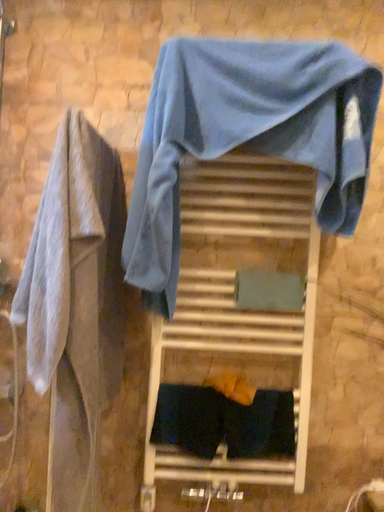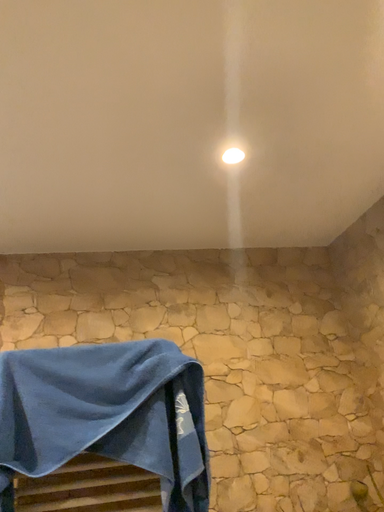
Question: How did the camera likely rotate when shooting the video?

Choices:
 (A) rotated upward
 (B) rotated downward

Answer: (A)